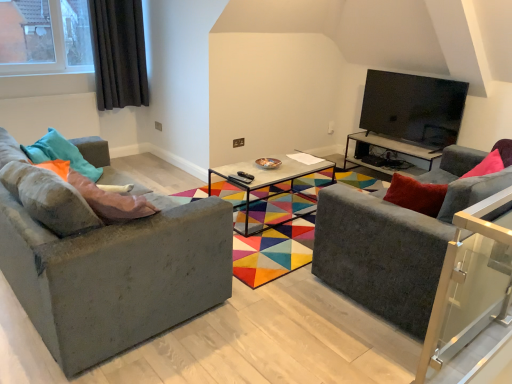
Question: From the image's perspective, does pink fabric pillow at left, the 2th pillow when ordered from left to right, appear lower than textured gray couch at left, which ranks as the second studio couch in right-to-left order?

Choices:
 (A) yes
 (B) no

Answer: (B)

Question: Is pink fabric pillow at left, the 2th pillow when ordered from left to right, positioned before textured gray couch at left, which ranks as the second studio couch in right-to-left order?

Choices:
 (A) yes
 (B) no

Answer: (B)

Question: Does pink fabric pillow at left, the 2th pillow when ordered from left to right, have a larger size compared to textured gray couch at left, which ranks as the second studio couch in right-to-left order?

Choices:
 (A) yes
 (B) no

Answer: (B)

Question: Is pink fabric pillow at left, acting as the 1th pillow starting from the right, not near textured gray couch at left, which ranks as the second studio couch in right-to-left order?

Choices:
 (A) yes
 (B) no

Answer: (B)

Question: Does pink fabric pillow at left, the 2th pillow when ordered from left to right, have a smaller size compared to textured gray couch at left, acting as the first studio couch starting from the left?

Choices:
 (A) yes
 (B) no

Answer: (A)

Question: Is teal fabric pillow at left, the 1th pillow positioned from the left, to the left or to the right of black glossy tv at upper right in the image?

Choices:
 (A) left
 (B) right

Answer: (A)

Question: From a real-world perspective, relative to black glossy tv at upper right, is teal fabric pillow at left, which is the second pillow in right-to-left order, vertically above or below?

Choices:
 (A) above
 (B) below

Answer: (B)

Question: From the image's perspective, relative to black glossy tv at upper right, is teal fabric pillow at left, which is the second pillow in right-to-left order, above or below?

Choices:
 (A) below
 (B) above

Answer: (A)

Question: Would you say teal fabric pillow at left, the 1th pillow positioned from the left, is inside or outside black glossy tv at upper right?

Choices:
 (A) outside
 (B) inside

Answer: (A)

Question: Is pink fabric pillow at left, the 2th pillow when ordered from left to right, inside the boundaries of dark grey fabric curtain at upper left, or outside?

Choices:
 (A) outside
 (B) inside

Answer: (A)

Question: Is point (138, 213) positioned closer to the camera than point (128, 11)?

Choices:
 (A) farther
 (B) closer

Answer: (B)

Question: In terms of size, does pink fabric pillow at left, the 2th pillow when ordered from left to right, appear bigger or smaller than dark grey fabric curtain at upper left?

Choices:
 (A) big
 (B) small

Answer: (B)

Question: In terms of width, does pink fabric pillow at left, the 2th pillow when ordered from left to right, look wider or thinner when compared to dark grey fabric curtain at upper left?

Choices:
 (A) thin
 (B) wide

Answer: (B)

Question: From a real-world perspective, is concrete textured coffee table at center above or below dark grey fabric curtain at upper left?

Choices:
 (A) above
 (B) below

Answer: (B)

Question: Is point (x=248, y=190) closer or farther from the camera than point (x=122, y=54)?

Choices:
 (A) farther
 (B) closer

Answer: (B)